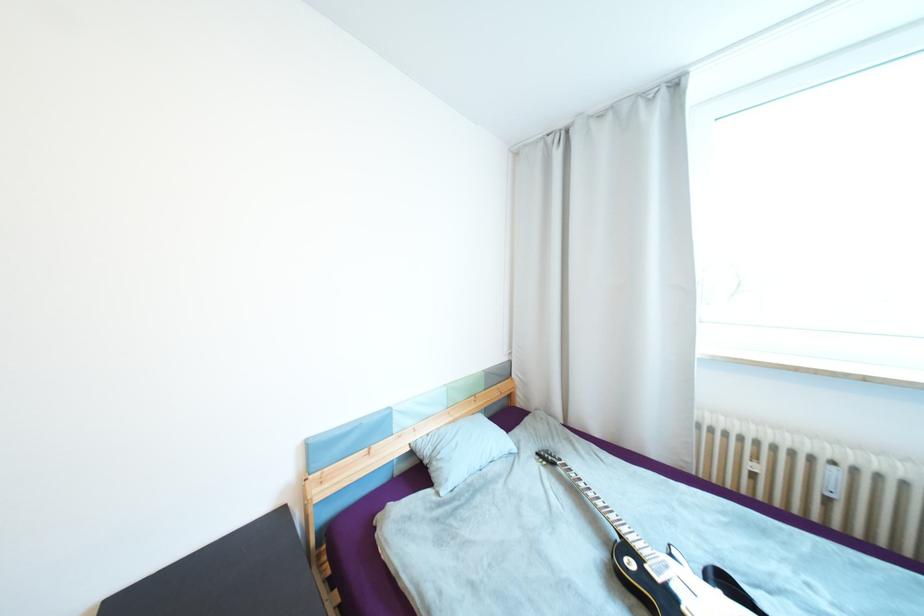
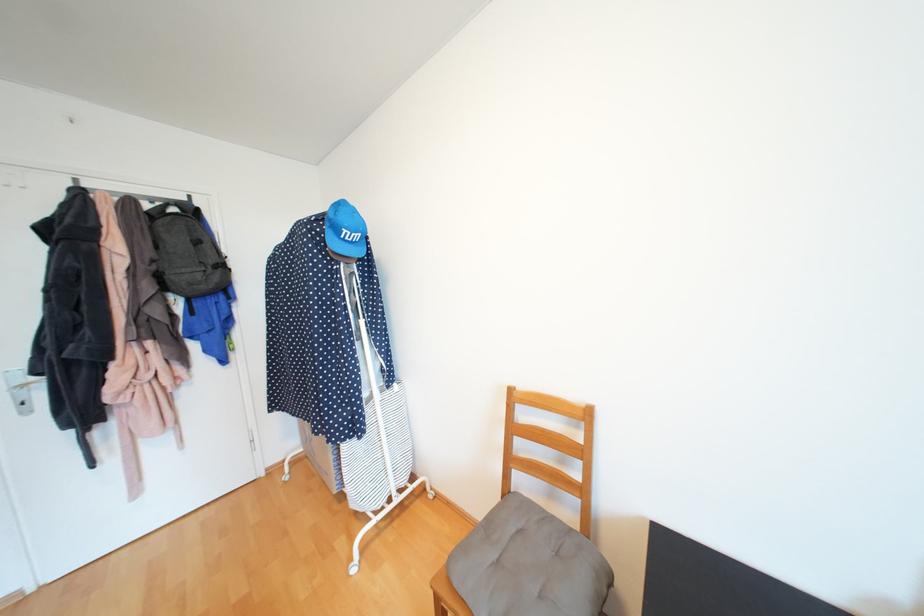
Question: Based on the continuous images, in which direction is the camera rotating? Reply with the corresponding letter.

Choices:
 (A) Left
 (B) Right
 (C) Up
 (D) Down

Answer: (A)